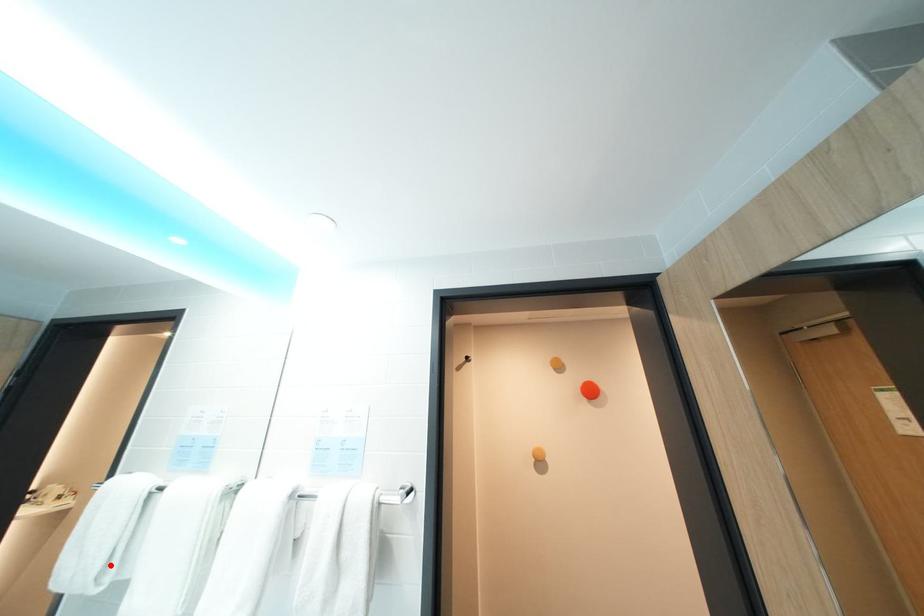
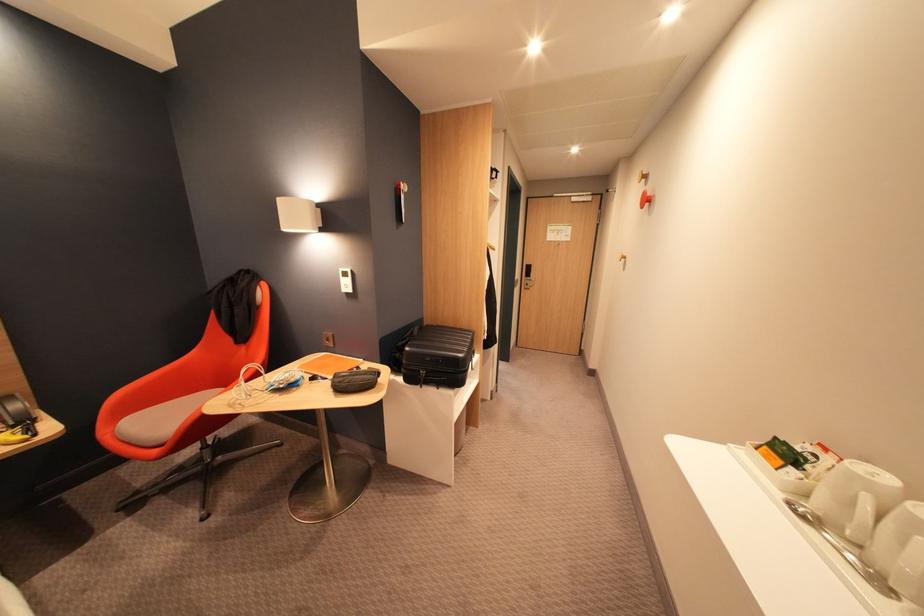
Question: I am providing you with two images of the same scene from different viewpoints. A red point is marked on the first image. Can you still see the location of the red point in image 2?

Choices:
 (A) Yes
 (B) No

Answer: (B)